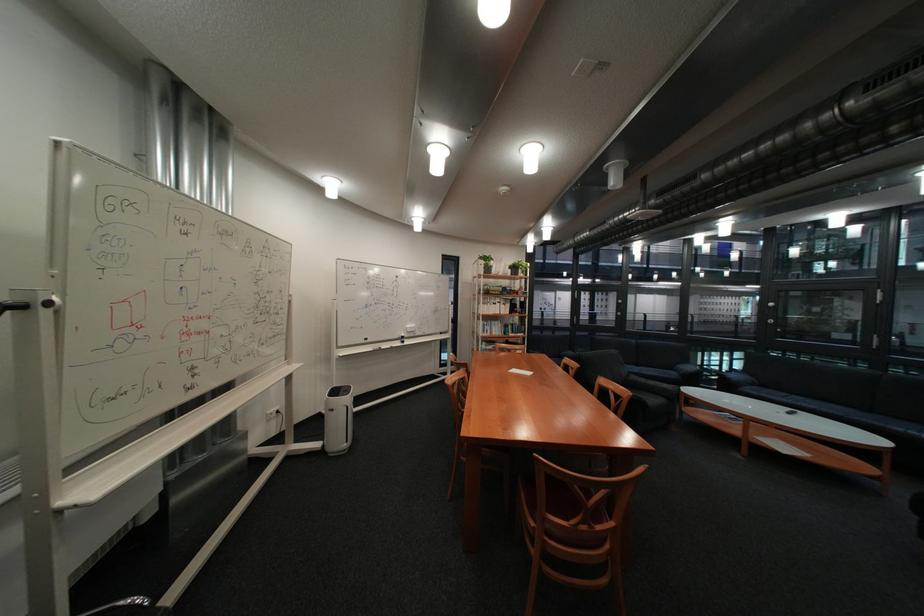
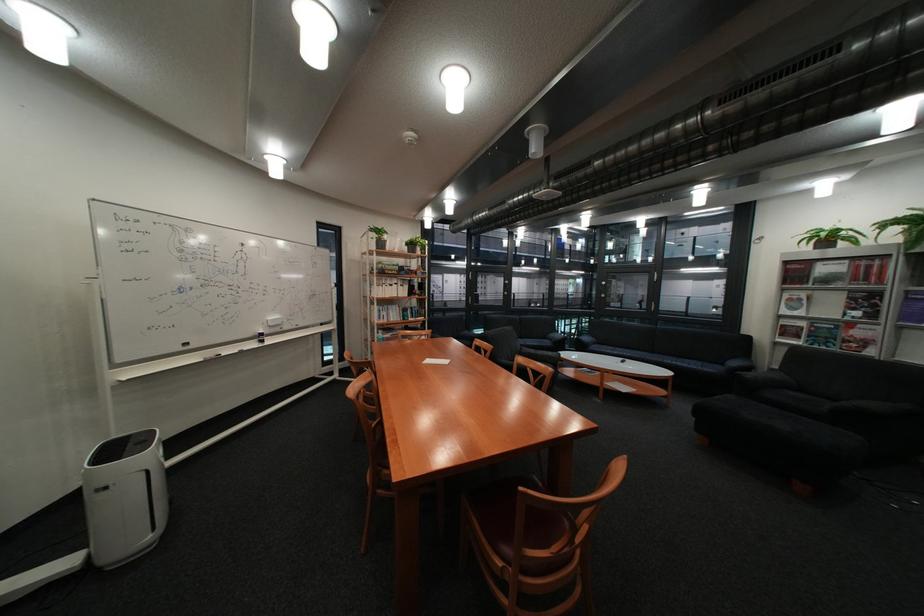
Locate, in the second image, the point that corresponds to (x=493, y=270) in the first image.

(383, 246)